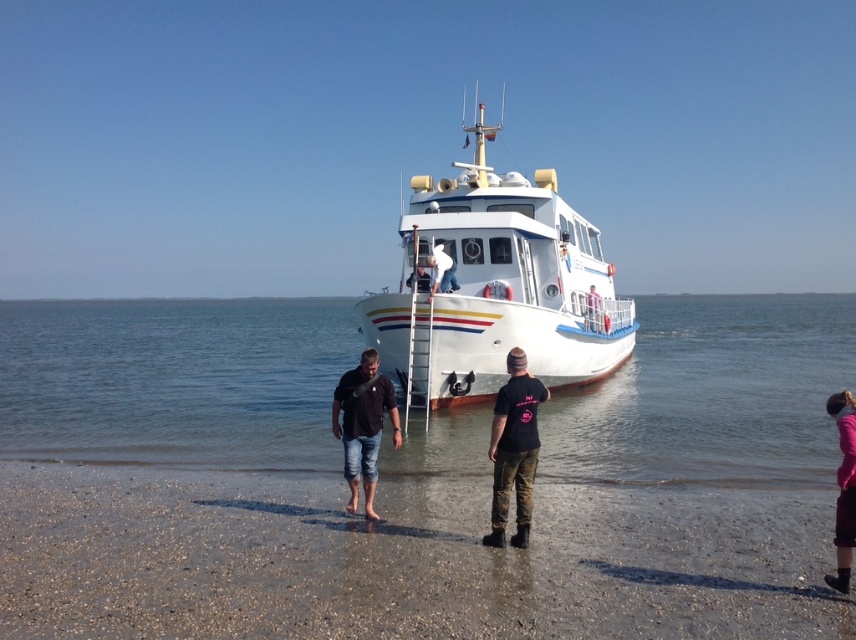
Question: Which point is farther to the camera?

Choices:
 (A) (559, 515)
 (B) (280, 333)

Answer: (B)

Question: Does black denim jeans at lower center have a larger size compared to white matte life preserver at upper center?

Choices:
 (A) yes
 (B) no

Answer: (B)

Question: Which point is closer to the camera taking this photo?

Choices:
 (A) (544, 358)
 (B) (366, 595)
 (C) (833, 412)

Answer: (B)

Question: Considering the real-world distances, which object is closest to the pink fabric at lower right?

Choices:
 (A) white glossy boat at center
 (B) black denim jeans at lower center
 (C) smooth sand at lower center
 (D) black cotton t-shirt at center

Answer: (D)

Question: Does pink fabric at lower right appear under white matte life preserver at upper center?

Choices:
 (A) yes
 (B) no

Answer: (A)

Question: Does smooth sand at lower center have a greater width compared to clear water at lower center?

Choices:
 (A) yes
 (B) no

Answer: (B)